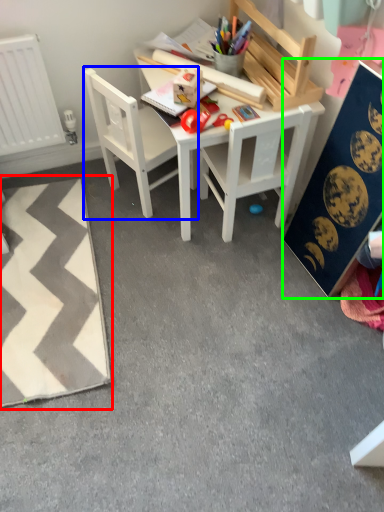
Question: Based on their relative distances, which object is farther from mat (highlighted by a red box)? Choose from chair (highlighted by a blue box) and bulletin board (highlighted by a green box).

Choices:
 (A) chair
 (B) bulletin board

Answer: (B)